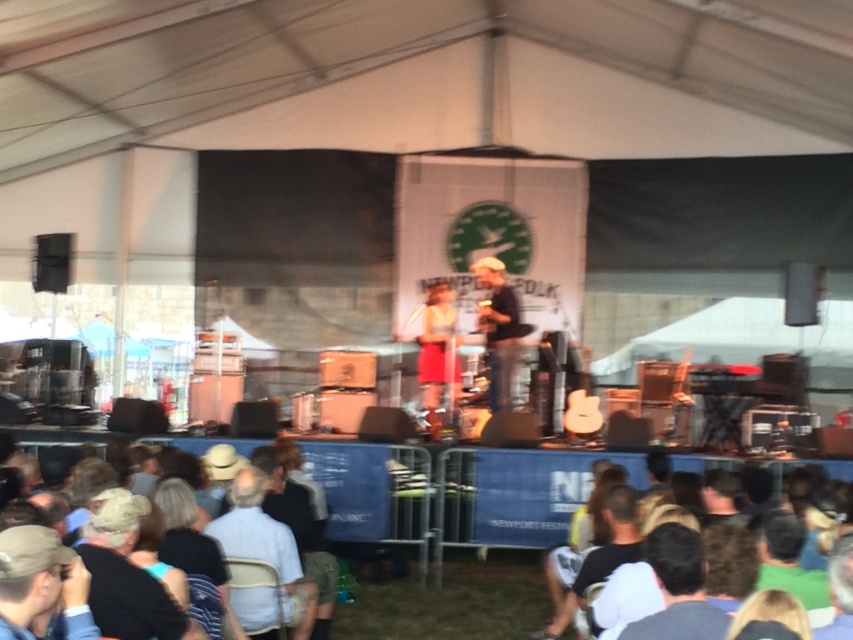
Question: Can you confirm if brown hair at lower center is positioned above matte brown hat at center?

Choices:
 (A) no
 (B) yes

Answer: (A)

Question: Which point is closer to the camera taking this photo?

Choices:
 (A) (746, 570)
 (B) (440, 320)
 (C) (120, 572)
 (D) (490, 300)

Answer: (A)

Question: Which of these objects is positioned closest to the brown hair at lower center?

Choices:
 (A) dark blue fabric at lower left
 (B) matte brown hat at center

Answer: (A)

Question: Does light blue fabric at lower center appear under brown hair at lower center?

Choices:
 (A) no
 (B) yes

Answer: (B)

Question: Does light blue fabric at lower center come in front of brown hair at lower center?

Choices:
 (A) yes
 (B) no

Answer: (A)

Question: Estimate the real-world distances between objects in this image. Which object is farther from the light blue fabric at lower center?

Choices:
 (A) brown hair at lower center
 (B) matte brown hat at center
 (C) yellow fabric shirt at center

Answer: (C)